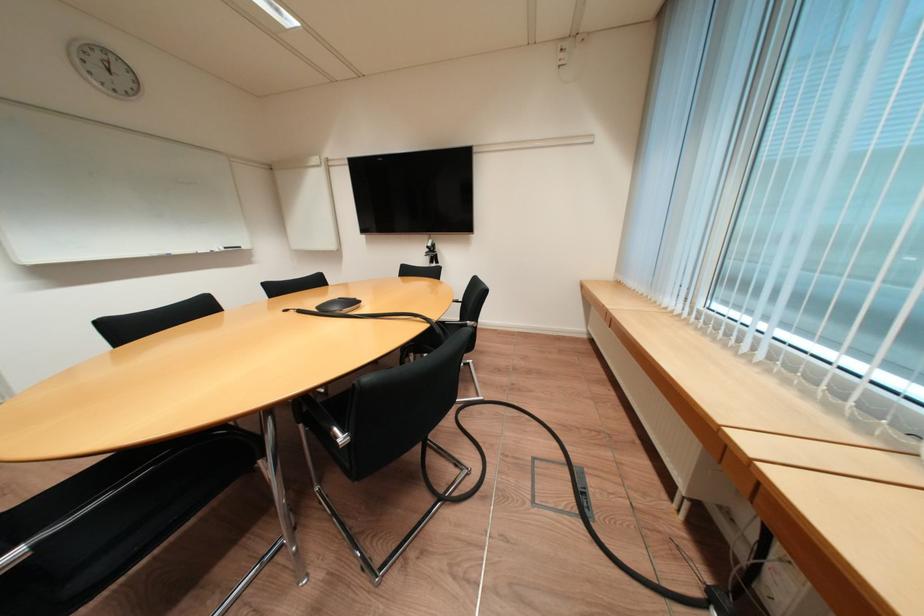
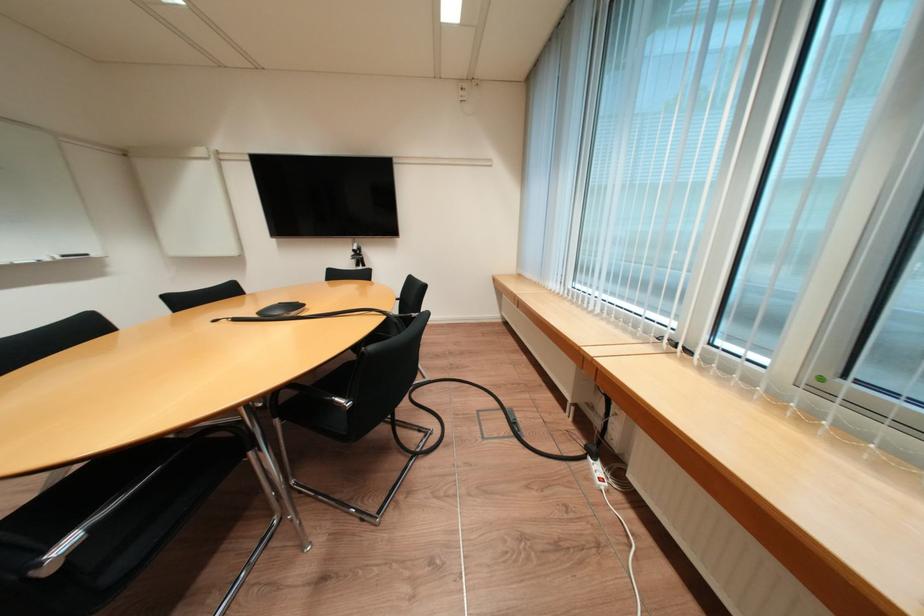
In the second image, find the point that corresponds to (x=43, y=546) in the first image.

(99, 531)